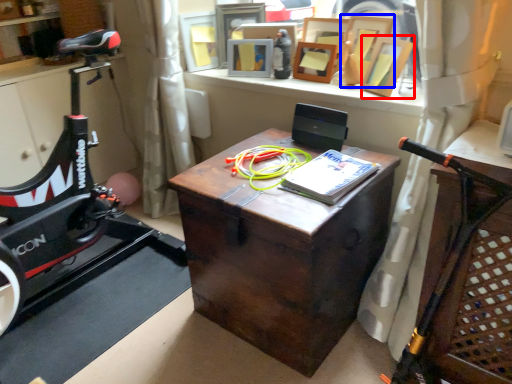
Question: Which point is further to the camera, picture frame (highlighted by a red box) or picture frame (highlighted by a blue box)?

Choices:
 (A) picture frame
 (B) picture frame

Answer: (B)